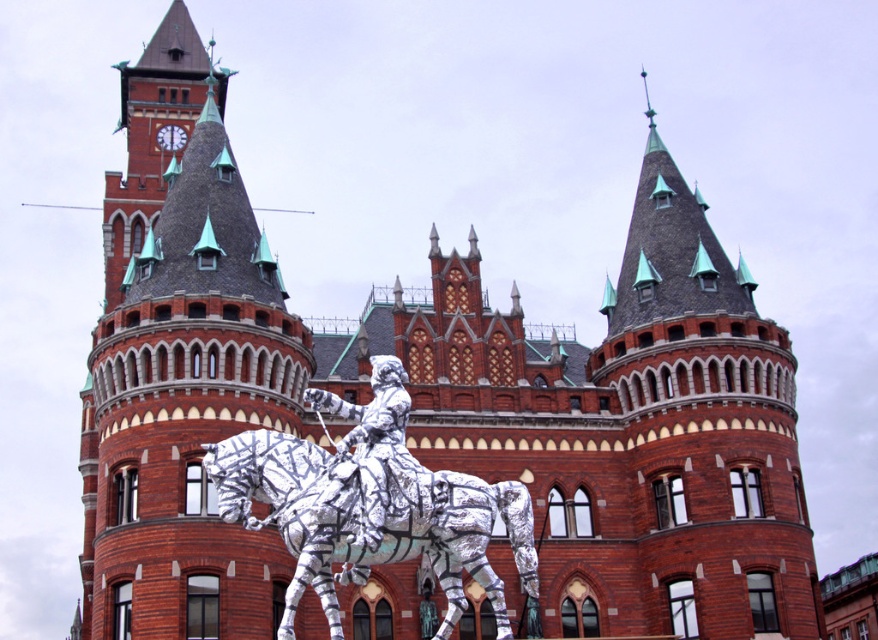
Question: Can you confirm if silver metallic horse at center is positioned above silver metallic horseman at center?

Choices:
 (A) no
 (B) yes

Answer: (A)

Question: Does silver metallic horse at center appear under silver metallic horseman at center?

Choices:
 (A) yes
 (B) no

Answer: (A)

Question: Is silver metallic horse at center behind silver metallic horseman at center?

Choices:
 (A) no
 (B) yes

Answer: (A)

Question: Which point appears closest to the camera in this image?

Choices:
 (A) pos(398,371)
 (B) pos(286,515)

Answer: (B)

Question: Which point is closer to the camera taking this photo?

Choices:
 (A) (408, 497)
 (B) (293, 532)

Answer: (B)